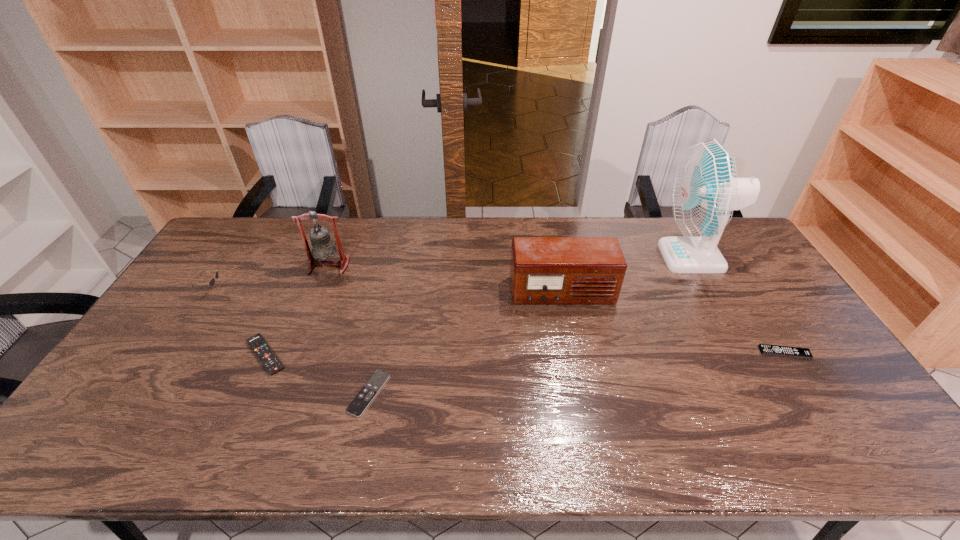
I want to click on fan, so click(705, 191).

The height and width of the screenshot is (540, 960). I want to click on the second tallest object, so click(x=323, y=247).

The width and height of the screenshot is (960, 540). In order to click on radio receiver in this screenshot , I will do `click(544, 270)`.

The height and width of the screenshot is (540, 960). Identify the location of the fifth object from left to right. [x=544, y=270].

Locate an element on the screen. The image size is (960, 540). sunglasses is located at coordinates (212, 281).

Where is `the fourth tallest object`? the fourth tallest object is located at coordinates (212, 281).

Identify the location of the leftmost remote control. (272, 364).

At what (x,y) coordinates should I click in order to perform the action: click on the rightmost remote control. Please return your answer as a coordinate pair (x, y). Looking at the image, I should click on (765, 349).

Find the location of a particular element. This screenshot has width=960, height=540. the shortest remote control is located at coordinates (360, 403).

In order to click on the shortest object in this screenshot , I will do `click(360, 403)`.